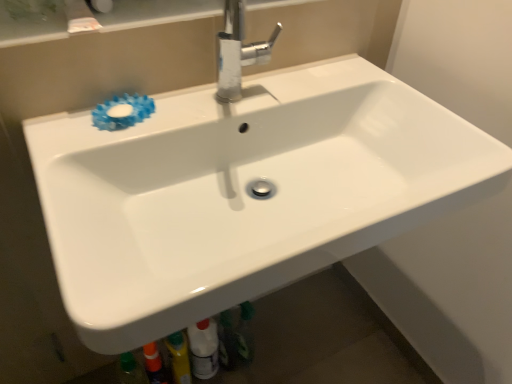
Question: Considering the relative sizes of blue rubber flower at upper left and white glossy bottle at lower center in the image provided, is blue rubber flower at upper left thinner than white glossy bottle at lower center?

Choices:
 (A) no
 (B) yes

Answer: (A)

Question: Is blue rubber flower at upper left taller than white glossy bottle at lower center?

Choices:
 (A) no
 (B) yes

Answer: (A)

Question: Is blue rubber flower at upper left at the left side of white glossy bottle at lower center?

Choices:
 (A) yes
 (B) no

Answer: (A)

Question: Can you see blue rubber flower at upper left touching white glossy bottle at lower center?

Choices:
 (A) yes
 (B) no

Answer: (B)

Question: From a real-world perspective, is blue rubber flower at upper left under white glossy bottle at lower center?

Choices:
 (A) yes
 (B) no

Answer: (B)

Question: Is point (102, 129) closer or farther from the camera than point (232, 97)?

Choices:
 (A) closer
 (B) farther

Answer: (A)

Question: Is blue rubber flower at upper left inside or outside of polished chrome faucet at upper center?

Choices:
 (A) outside
 (B) inside

Answer: (A)

Question: Considering the positions of blue rubber flower at upper left and polished chrome faucet at upper center in the image, is blue rubber flower at upper left bigger or smaller than polished chrome faucet at upper center?

Choices:
 (A) big
 (B) small

Answer: (B)

Question: Is blue rubber flower at upper left in front of or behind polished chrome faucet at upper center in the image?

Choices:
 (A) behind
 (B) front

Answer: (A)

Question: From a real-world perspective, is white glossy bottle at lower center positioned above or below polished chrome faucet at upper center?

Choices:
 (A) above
 (B) below

Answer: (B)

Question: Considering the positions of white glossy bottle at lower center and polished chrome faucet at upper center in the image, is white glossy bottle at lower center taller or shorter than polished chrome faucet at upper center?

Choices:
 (A) short
 (B) tall

Answer: (B)

Question: From the image's perspective, is white glossy bottle at lower center located above or below polished chrome faucet at upper center?

Choices:
 (A) above
 (B) below

Answer: (B)

Question: Is white glossy bottle at lower center inside or outside of polished chrome faucet at upper center?

Choices:
 (A) outside
 (B) inside

Answer: (A)

Question: In terms of width, does white glossy bottle at lower center look wider or thinner when compared to blue rubber flower at upper left?

Choices:
 (A) thin
 (B) wide

Answer: (A)

Question: From the image's perspective, relative to blue rubber flower at upper left, is white glossy bottle at lower center above or below?

Choices:
 (A) below
 (B) above

Answer: (A)